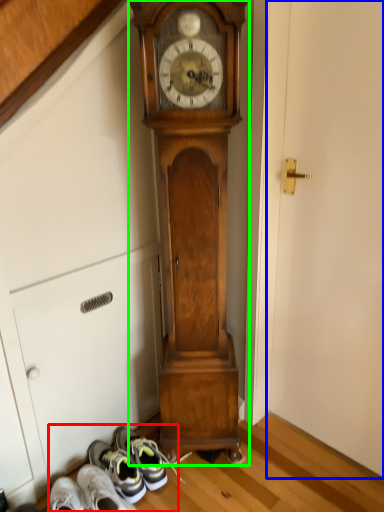
Question: Estimate the real-world distances between objects in this image. Which object is closer to shoe (highlighted by a red box), door (highlighted by a blue box) or wall clock (highlighted by a green box)?

Choices:
 (A) door
 (B) wall clock

Answer: (B)